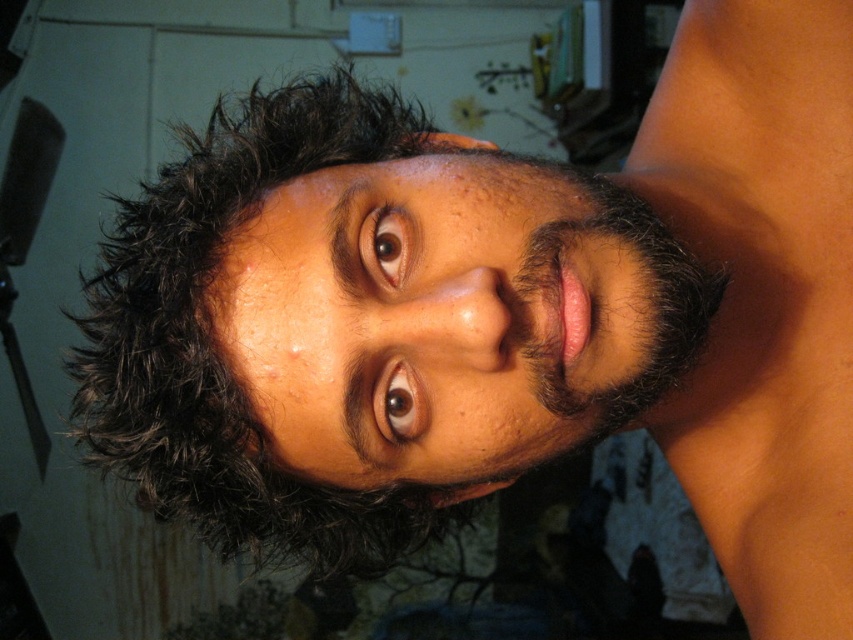
You are taking a photo of the person and want to ensure both the dark brown curly hair at upper center and the brown matte eye at center are in focus. Which object should you focus on first to ensure depth of field captures both?

You should focus on the brown matte eye at center first because it is closer to the camera than the dark brown curly hair at upper center, ensuring the depth of field includes both.

You are taking a photo with a camera that has a minimum focus distance of 18 inches. You want to focus on the point at coordinates point (393, 250). Will your camera be able to focus on that point?

The point (393, 250) is 20.09 inches from the camera, which is beyond the minimum focus distance of 18 inches. Therefore, the camera should be able to focus on that point.